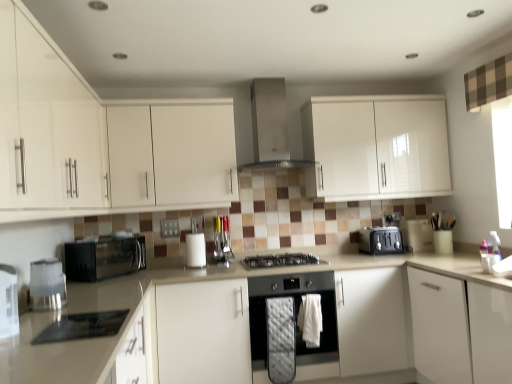
The image size is (512, 384). I want to click on empty space that is ontop of stainless steel range hood at upper center, acting as the second home appliance starting from the left, so click(269, 74).